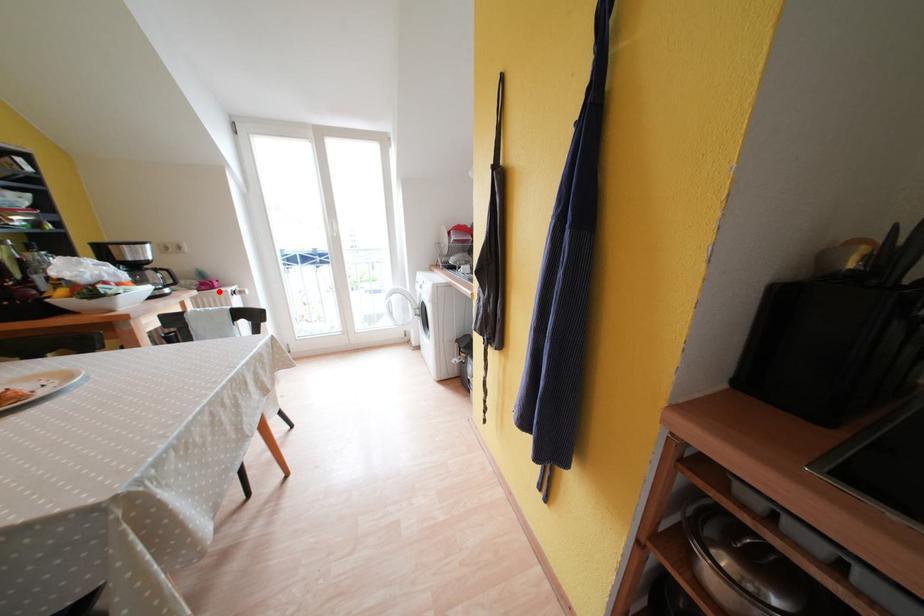
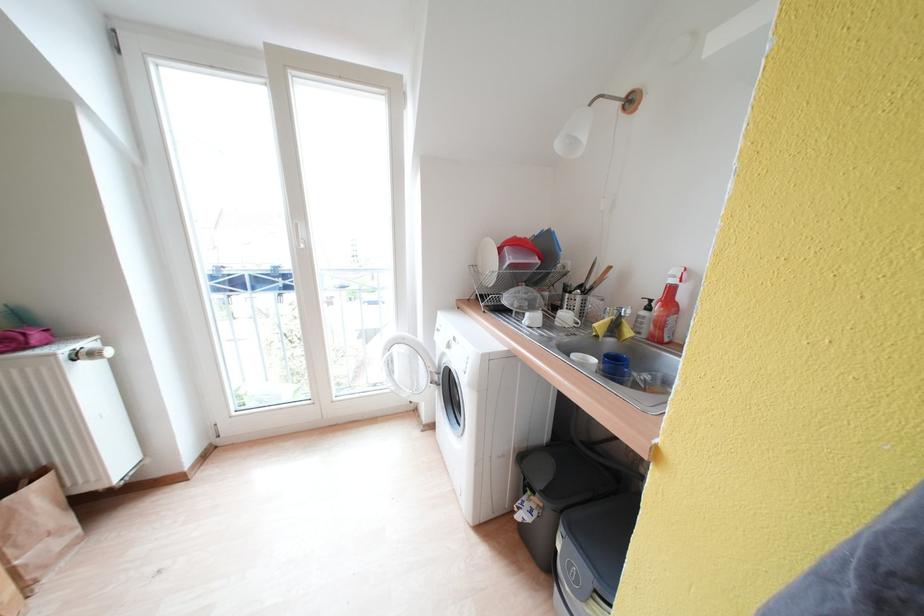
Question: I am providing you with two images of the same scene from different viewpoints. A red point is shown in image1. For the corresponding object point in image2, is it positioned nearer or farther from the camera?

Choices:
 (A) Nearer
 (B) Farther

Answer: (B)